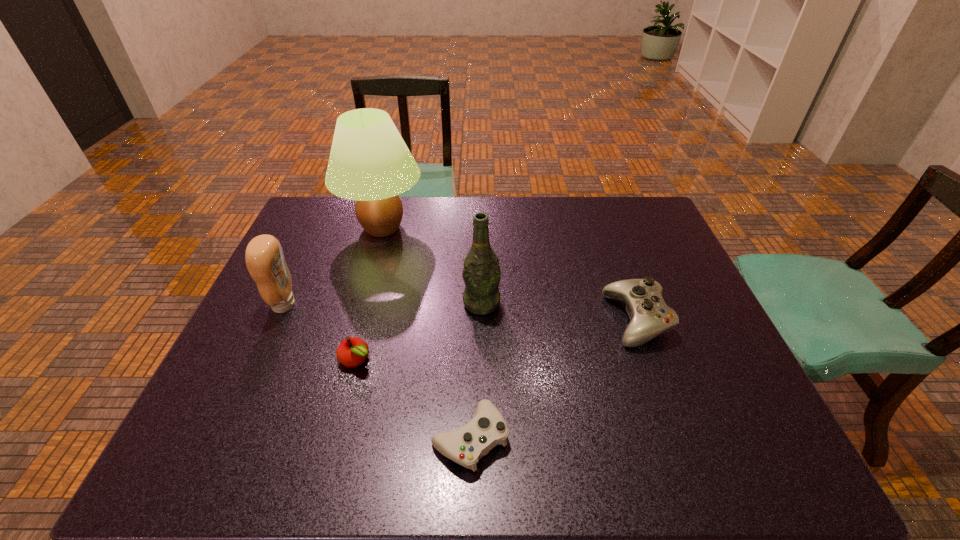
Where is `the farthest object`? This screenshot has height=540, width=960. the farthest object is located at coordinates (369, 162).

At what (x,y) coordinates should I click in order to perform the action: click on lampshade. Please return your answer as a coordinate pair (x, y). The image size is (960, 540). Looking at the image, I should click on (369, 162).

This screenshot has height=540, width=960. I want to click on the second tallest object, so click(481, 273).

The width and height of the screenshot is (960, 540). In order to click on the leftmost object in this screenshot , I will do [264, 257].

At what (x,y) coordinates should I click in order to perform the action: click on the fourth shortest object. Please return your answer as a coordinate pair (x, y). The image size is (960, 540). Looking at the image, I should click on (264, 257).

Where is `the right control`? The height and width of the screenshot is (540, 960). the right control is located at coordinates (650, 316).

This screenshot has height=540, width=960. I want to click on the rightmost object, so click(x=650, y=316).

I want to click on apple, so click(x=353, y=351).

Image resolution: width=960 pixels, height=540 pixels. What are the coordinates of `the shortest object` in the screenshot? It's located at (467, 445).

I want to click on the shorter control, so click(x=467, y=445).